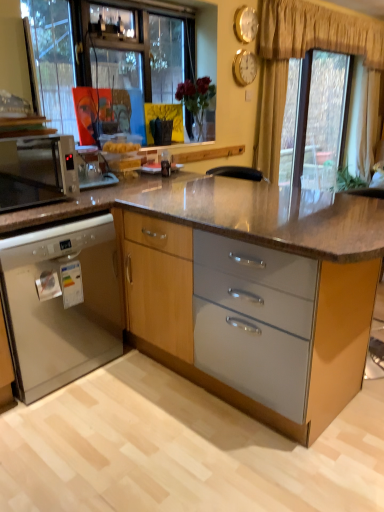
Question: Does gold textured curtain at upper center have a smaller size compared to transparent glass window at upper right?

Choices:
 (A) no
 (B) yes

Answer: (A)

Question: Does gold textured curtain at upper center have a larger size compared to transparent glass window at upper right?

Choices:
 (A) yes
 (B) no

Answer: (A)

Question: Are gold textured curtain at upper center and transparent glass window at upper right located far from each other?

Choices:
 (A) yes
 (B) no

Answer: (B)

Question: Considering the relative positions of gold textured curtain at upper center and transparent glass window at upper right in the image provided, is gold textured curtain at upper center behind transparent glass window at upper right?

Choices:
 (A) no
 (B) yes

Answer: (A)

Question: Is gold textured curtain at upper center taller than transparent glass window at upper right?

Choices:
 (A) no
 (B) yes

Answer: (A)

Question: From a real-world perspective, is gold textured curtain at upper center positioned over transparent glass window at upper right based on gravity?

Choices:
 (A) no
 (B) yes

Answer: (B)

Question: Is transparent glass window at upper right not inside gold metallic clock at upper center, which ranks as the first clock in bottom-to-top order?

Choices:
 (A) no
 (B) yes

Answer: (B)

Question: Does transparent glass window at upper right have a smaller size compared to gold metallic clock at upper center, which ranks as the first clock in bottom-to-top order?

Choices:
 (A) no
 (B) yes

Answer: (A)

Question: Considering the relative sizes of transparent glass window at upper right and gold metallic clock at upper center, which ranks as the first clock in bottom-to-top order, in the image provided, is transparent glass window at upper right shorter than gold metallic clock at upper center, which ranks as the first clock in bottom-to-top order,?

Choices:
 (A) no
 (B) yes

Answer: (A)

Question: Does transparent glass window at upper right have a lesser width compared to gold metallic clock at upper center, which ranks as the first clock in bottom-to-top order?

Choices:
 (A) no
 (B) yes

Answer: (A)

Question: Is transparent glass window at upper right oriented away from gold metallic clock at upper center, which ranks as the second clock in top-to-bottom order?

Choices:
 (A) no
 (B) yes

Answer: (A)

Question: Is gold metallic clock at upper center, which ranks as the first clock in bottom-to-top order, surrounded by transparent glass window at upper right?

Choices:
 (A) no
 (B) yes

Answer: (A)

Question: Is matte wood cabinet at center, the 1th cabinetry in the right-to-left sequence, completely or partially outside of satin black microwave at left?

Choices:
 (A) no
 (B) yes

Answer: (B)